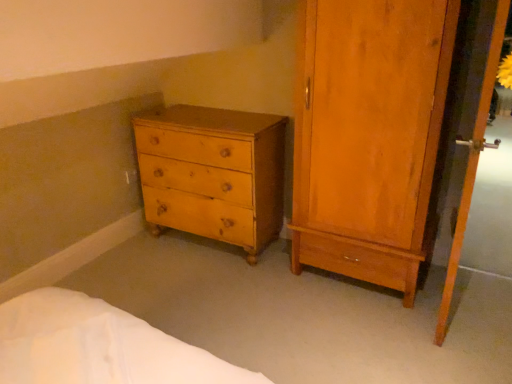
Where is `free spot in front of matte wood wardrobe at right`? free spot in front of matte wood wardrobe at right is located at coordinates (371, 339).